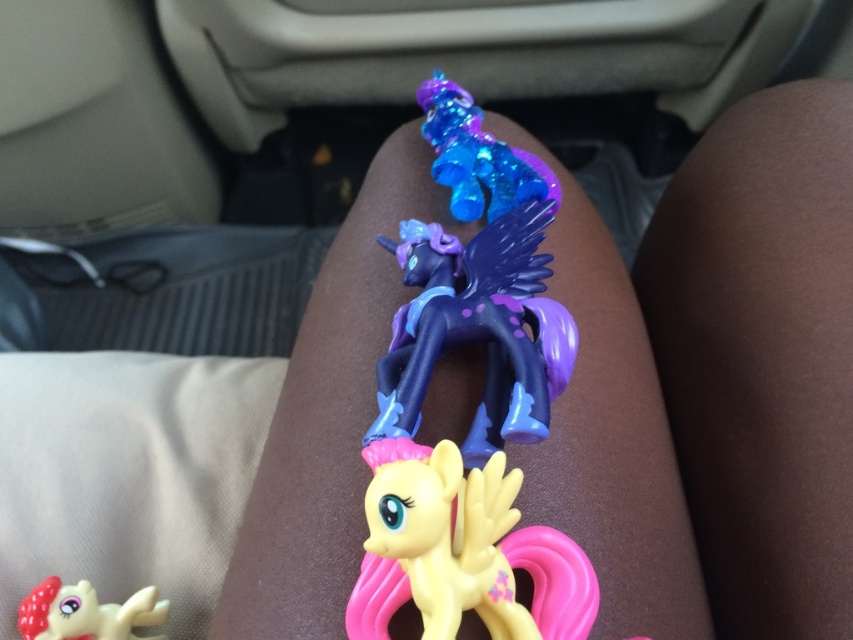
You are sitting in the backseat of the car and want to reach the middle My Little Pony figurine on someone else lap. The figurine is located at point (x=541, y=564). Can you reach it if your arm can extend 35 inches?

The point (x=541, y=564) is 30.22 inches from the viewer. Since your arm can extend 35 inches, you can reach the middle My Little Pony figurine at point (x=541, y=564).

You are sitting in the backseat of a car and notice two points on the floor mat. The first point is at coordinates point (503, 323) and the second is at point (161, 612). Which point is closer to you?

Point (503, 323) is closer to you than point (161, 612) because it is positioned closer to the camera in the image.

You are sitting in a car and holding three My Little Pony figurines on your lap. You notice the yellow matte plastic pony at center and the shiny plastic pony at lower left. Which of these two ponies is taller?

The yellow matte plastic pony at center is taller than the shiny plastic pony at lower left.